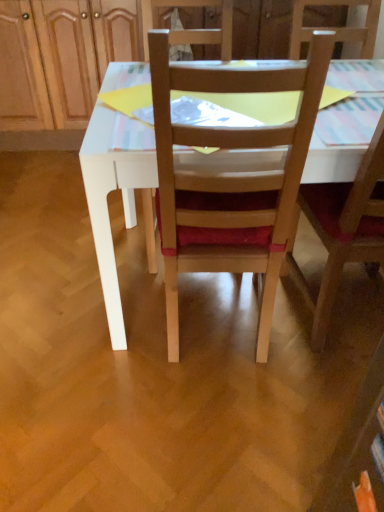
The width and height of the screenshot is (384, 512). I want to click on vacant point to the left of wooden chair at center, positioned as the 1th chair in right-to-left order, so click(283, 341).